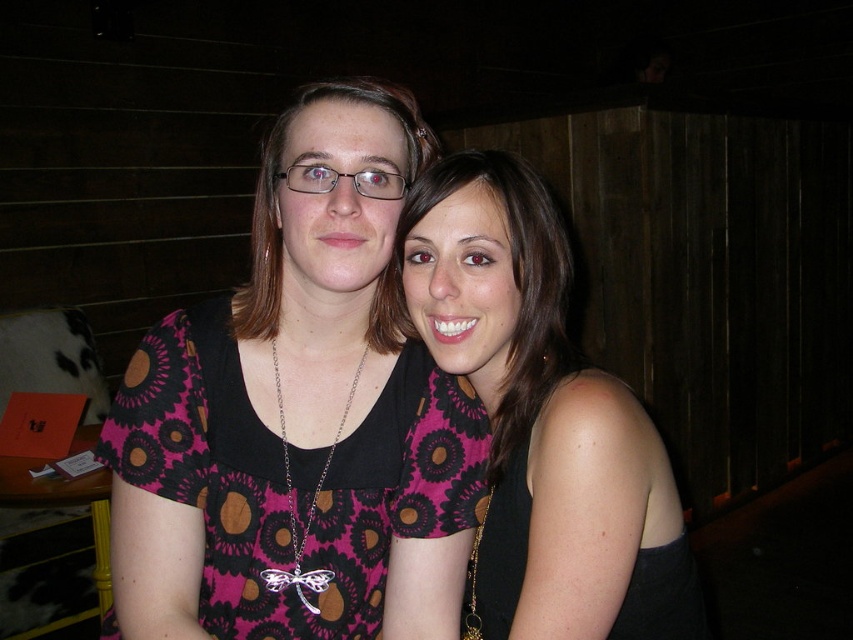
Is black matte dress at right shorter than pink dotted dress at center?

Yes, black matte dress at right is shorter than pink dotted dress at center.

Who is higher up, black matte dress at right or pink dotted dress at center?

pink dotted dress at center

Between point (647, 557) and point (254, 248), which one is positioned behind?

Point (254, 248)

You are a GUI agent. You are given a task and a screenshot of the screen. Output one action in this format:
    pyautogui.click(x=<x>, y=<y>)
    Task: Click on the black matte dress at right
    Image resolution: width=853 pixels, height=640 pixels.
    Given the screenshot: What is the action you would take?
    pyautogui.click(x=500, y=550)

Which is below, pink floral dress at center or black matte dress at right?

black matte dress at right is lower down.

Locate an element on the screen. pink floral dress at center is located at coordinates (543, 420).

Find the location of `pink floral dress at center`. pink floral dress at center is located at coordinates (543, 420).

Can you confirm if pink printed fabric dress at center is bigger than black matte dress at right?

Indeed, pink printed fabric dress at center has a larger size compared to black matte dress at right.

Find the location of a particular element. The width and height of the screenshot is (853, 640). pink printed fabric dress at center is located at coordinates (285, 481).